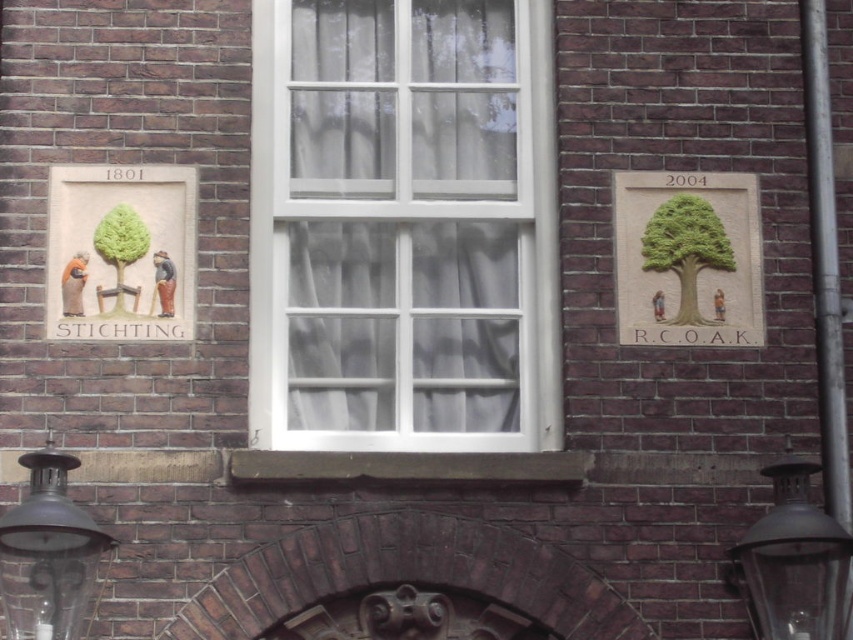
You are an electrician who needs to install a new light fixture. You notice the bronze metallic lamp at lower left and the black glass lamp at lower right. Which lamp would require a taller mounting bracket to accommodate its height?

The bronze metallic lamp at lower left has a greater height compared to the black glass lamp at lower right, so it would require a taller mounting bracket to accommodate its height.

Consider the image. You are standing in front of the brick building and notice the matte beige plaque at left and the black glass lamp at lower right. Which object is located higher up on the wall?

The matte beige plaque at left is positioned over the black glass lamp at lower right, so it is higher up on the wall.